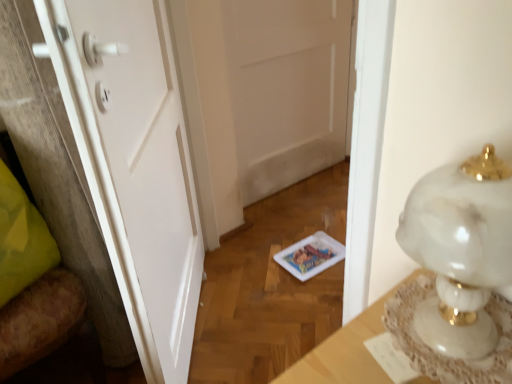
In order to face white marble table at right, should I rotate leftwards or rightwards?

Turn right approximately 24.389 degrees to face it.

Find the location of a particular element. white marble table at right is located at coordinates (347, 350).

What do you see at coordinates (32, 284) in the screenshot? Image resolution: width=512 pixels, height=384 pixels. I see `wooden chair at left` at bounding box center [32, 284].

Identify the location of wooden chair at left. The height and width of the screenshot is (384, 512). (32, 284).

At what (x,y) coordinates should I click in order to perform the action: click on white marble lamp at right. Please return your answer as a coordinate pair (x, y). The height and width of the screenshot is (384, 512). Looking at the image, I should click on (461, 250).

Image resolution: width=512 pixels, height=384 pixels. Describe the element at coordinates (134, 164) in the screenshot. I see `white matte door at center, the second door from the right` at that location.

What is the approximate width of white matte door at center, the 2th door when ordered from back to front?

white matte door at center, the 2th door when ordered from back to front, is 6.07 inches in width.

What is the approximate height of white matte door at center, acting as the first door starting from the back?

The height of white matte door at center, acting as the first door starting from the back, is 3.31 feet.

Describe the element at coordinates (288, 88) in the screenshot. The image size is (512, 384). I see `white matte door at center, the first door when ordered from right to left` at that location.

The image size is (512, 384). Find the location of `white marble table at right`. white marble table at right is located at coordinates (347, 350).

From a real-world perspective, does white marble lamp at right stand above white marble table at right?

Yes.

Is white marble lamp at right turned away from white marble table at right?

No, white marble lamp at right's orientation is not away from white marble table at right.

Who is bigger, white marble lamp at right or white marble table at right?

Bigger between the two is white marble lamp at right.

Considering the positions of objects white matte door at center, which is the 1th door from left to right, and white marble table at right in the image provided, who is behind, white matte door at center, which is the 1th door from left to right, or white marble table at right?

white matte door at center, which is the 1th door from left to right.

Considering the positions of objects white matte door at center, the second door from the right, and white marble table at right in the image provided, who is more to the right, white matte door at center, the second door from the right, or white marble table at right?

Positioned to the right is white marble table at right.

Is white matte door at center, the 1th door viewed from the front, taller than white marble table at right?

Result: Indeed, white matte door at center, the 1th door viewed from the front, has a greater height compared to white marble table at right.

Is point (347, 337) closer to camera compared to point (298, 93)?

Yes, point (347, 337) is in front of point (298, 93).

What's the angular difference between white marble table at right and white matte door at center, which ranks as the 2th door in left-to-right order,'s facing directions?

The facing directions of white marble table at right and white matte door at center, which ranks as the 2th door in left-to-right order, are 92.9 degrees apart.

Which is more to the left, white marble table at right or white matte door at center, the second door when ordered from front to back?

white matte door at center, the second door when ordered from front to back.

Considering the sizes of white marble table at right and white matte door at center, acting as the first door starting from the back, in the image, is white marble table at right taller or shorter than white matte door at center, acting as the first door starting from the back,?

Clearly, white marble table at right is shorter compared to white matte door at center, acting as the first door starting from the back.

Are white matte door at center, the second door from the right, and white marble lamp at right making contact?

There is a gap between white matte door at center, the second door from the right, and white marble lamp at right.

From the image's perspective, would you say white matte door at center, the second door from the right, is positioned over white marble lamp at right?

Yes, from the image's perspective, white matte door at center, the second door from the right, is on top of white marble lamp at right.

Which object is thinner, white matte door at center, the 2th door when ordered from back to front, or white marble lamp at right?

white matte door at center, the 2th door when ordered from back to front.

Is white marble lamp at right positioned in front of wooden chair at left?

Yes.

How different are the orientations of white marble lamp at right and wooden chair at left in degrees?

The facing directions of white marble lamp at right and wooden chair at left are 93.3 degrees apart.

Looking at this image, between white marble lamp at right and wooden chair at left, which one has larger size?

With larger size is wooden chair at left.

Which is correct: white marble lamp at right is inside wooden chair at left, or outside of it?

white marble lamp at right cannot be found inside wooden chair at left.

Could you measure the distance between wooden chair at left and white matte door at center, the second door when ordered from front to back?

wooden chair at left and white matte door at center, the second door when ordered from front to back, are 4.20 feet apart from each other.

Looking at this image, who is smaller, wooden chair at left or white matte door at center, the first door when ordered from right to left?

With smaller size is white matte door at center, the first door when ordered from right to left.

Considering their positions, is wooden chair at left located in front of or behind white matte door at center, the first door when ordered from right to left?

Clearly, wooden chair at left is in front of white matte door at center, the first door when ordered from right to left.

Is point (59, 253) positioned in front of point (319, 91)?

Yes, point (59, 253) is closer to viewer.

Is wooden chair at left facing away from white matte door at center, the 1th door viewed from the front?

No, wooden chair at left is not facing the opposite direction of white matte door at center, the 1th door viewed from the front.

Is white matte door at center, which is the 1th door from left to right, a part of wooden chair at left?

Definitely not — white matte door at center, which is the 1th door from left to right, is not inside wooden chair at left.

I want to click on door that is the 1st object located above the wooden chair at left (from the image's perspective), so click(x=134, y=164).

Considering the positions of objects wooden chair at left and white matte door at center, the 2th door when ordered from back to front, in the image provided, who is more to the left, wooden chair at left or white matte door at center, the 2th door when ordered from back to front,?

wooden chair at left is more to the left.

Image resolution: width=512 pixels, height=384 pixels. I want to click on lamp that is in front of the white marble table at right, so click(x=461, y=250).

In order to click on the 1st door located beneath the white marble table at right (from a real-world perspective) in this screenshot , I will do `click(134, 164)`.

Estimate the real-world distances between objects in this image. Which object is further from white matte door at center, the second door from the right, white matte door at center, the second door when ordered from front to back, or white marble table at right?

white matte door at center, the second door when ordered from front to back.

Which object lies nearer to the anchor point wooden chair at left, white matte door at center, the first door when ordered from right to left, or white marble lamp at right?

The object closer to wooden chair at left is white marble lamp at right.

Considering their positions, is white marble table at right positioned closer to wooden chair at left than white matte door at center, which ranks as the 2th door in left-to-right order?

white marble table at right lies closer to wooden chair at left than the other object.

Which object lies nearer to the anchor point white matte door at center, the 2th door when ordered from back to front, white marble lamp at right or wooden chair at left?

wooden chair at left is positioned closer to the anchor white matte door at center, the 2th door when ordered from back to front.

From the image, which object appears to be farther from white marble lamp at right, white marble table at right or wooden chair at left?

wooden chair at left is positioned further to the anchor white marble lamp at right.

Looking at the image, which one is located closer to white marble table at right, white marble lamp at right or wooden chair at left?

Based on the image, white marble lamp at right appears to be nearer to white marble table at right.

Which object lies further to the anchor point wooden chair at left, white marble lamp at right or white marble table at right?

white marble lamp at right is further to wooden chair at left.

When comparing their distances from white marble table at right, does wooden chair at left or white matte door at center, the first door when ordered from right to left, seem further?

white matte door at center, the first door when ordered from right to left, lies further to white marble table at right than the other object.

Find the location of a particular element. Image resolution: width=512 pixels, height=384 pixels. door between white marble table at right and white matte door at center, acting as the first door starting from the back, in the front-back direction is located at coordinates (134, 164).

Locate an element on the screen. furniture between white marble lamp at right and white matte door at center, the first door when ordered from right to left, along the z-axis is located at coordinates (32, 284).

Image resolution: width=512 pixels, height=384 pixels. What are the coordinates of `lamp located between white matte door at center, the 1th door viewed from the front, and white marble table at right in the left-right direction` in the screenshot? It's located at (461, 250).

Image resolution: width=512 pixels, height=384 pixels. In order to click on lamp between wooden chair at left and white marble table at right in the horizontal direction in this screenshot , I will do `click(461, 250)`.